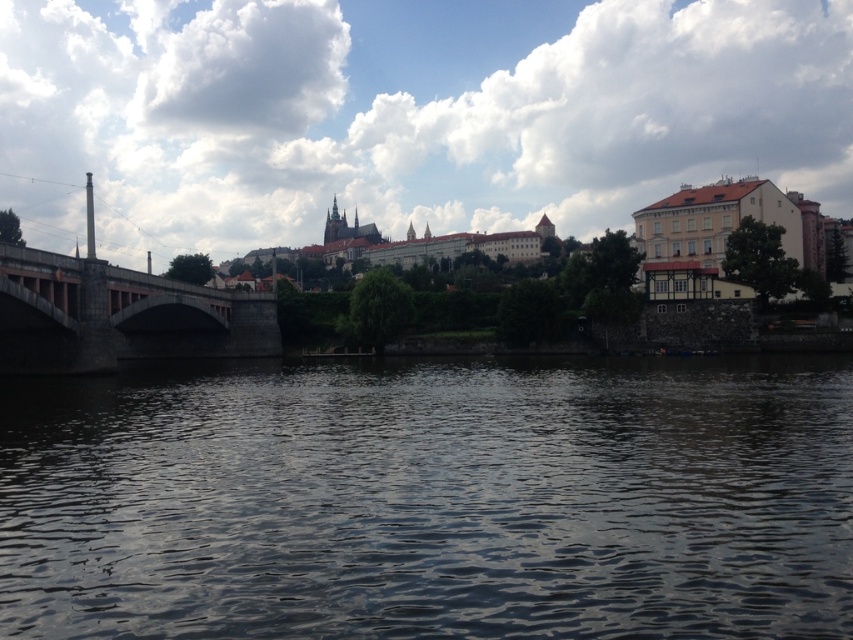
You are a boat captain planning to navigate a boat through the dark water at center near the dark gray stone bridge at left. Given that your boat requires a minimum of 30 meters of clearance to safely pass under the bridge, can you safely navigate under the bridge?

→ The dark water at center is 29.02 meters from the dark gray stone bridge at left. Since the boat requires 30 meters of clearance, it is insufficient. Therefore, navigating under the bridge may not be safe due to the insufficient clearance distance.

You are standing at the riverside and want to cross to the other side. You see the dark gray stone bridge at left and the dark water at center. Which one is closer to you?

The dark water at center is closer to the viewer than the dark gray stone bridge at left, so the dark water at center is closer.

You are standing at the point with coordinates point (93, 582) and want to walk towards the point (233, 298). Will you be moving towards or away from the stone bridge with a reddish pink arch?

Since point (93, 582) is in front of point (233, 298), moving from point (93, 582) towards point (233, 298) means you are moving away from the stone bridge with a reddish pink arch.